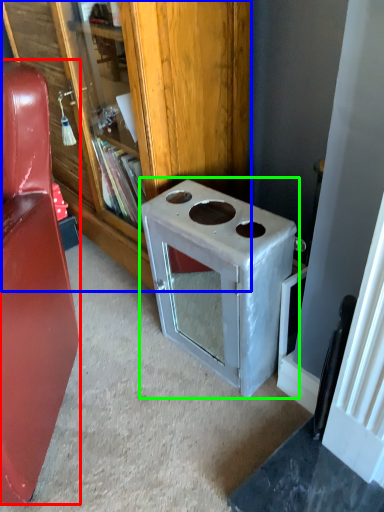
Question: Based on their relative distances, which object is farther from furniture (highlighted by a red box)? Choose from bookcase (highlighted by a blue box) and appliance (highlighted by a green box).

Choices:
 (A) bookcase
 (B) appliance

Answer: (A)